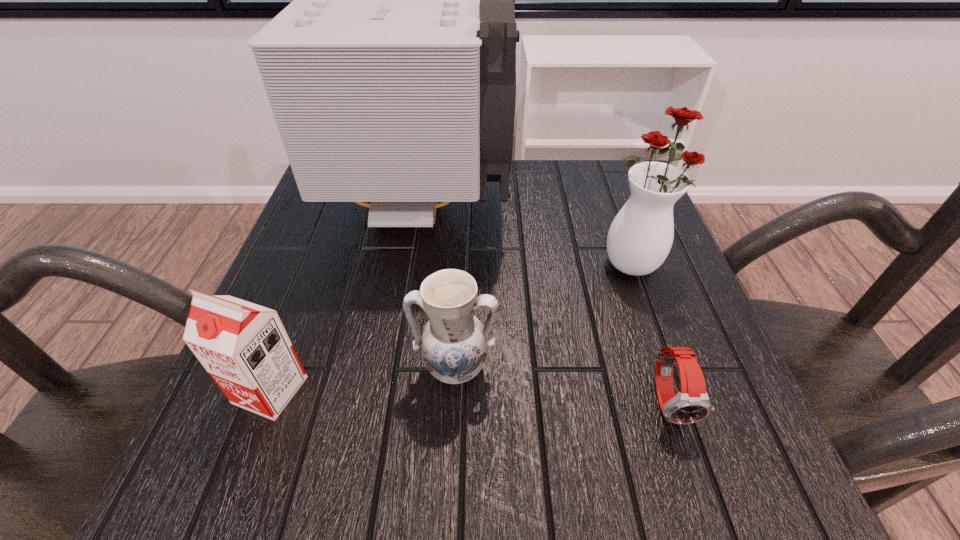
Identify the location of fan. (392, 75).

The image size is (960, 540). What are the coordinates of `vase` in the screenshot? It's located at (640, 237).

Where is `soya milk`? Image resolution: width=960 pixels, height=540 pixels. soya milk is located at coordinates (244, 347).

Identify the location of pottery. The height and width of the screenshot is (540, 960). (454, 344).

The width and height of the screenshot is (960, 540). What are the coordinates of `the shortest object` in the screenshot? It's located at 692,404.

Identify the location of free space located on the right of the fan. (624, 205).

Where is `free space located 0.260m on the back of the vase`? This screenshot has height=540, width=960. free space located 0.260m on the back of the vase is located at coordinates (602, 176).

The image size is (960, 540). What are the coordinates of `free space located 0.050m on the front of the soya milk` in the screenshot? It's located at (246, 455).

Locate an element on the screen. This screenshot has width=960, height=540. free space located 0.070m on the face of the shortest object is located at coordinates (696, 482).

Where is `object that is positioned at the far edge`? object that is positioned at the far edge is located at coordinates (392, 75).